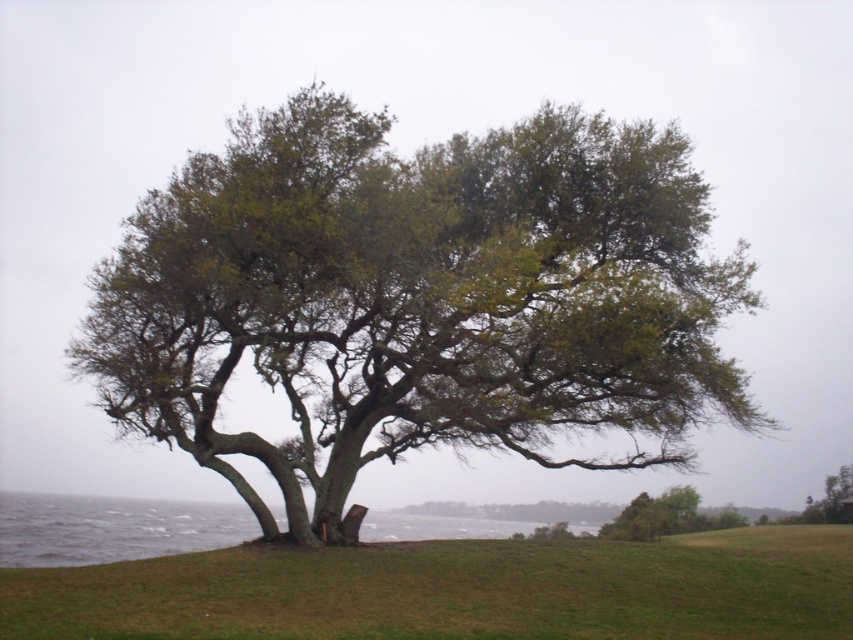
You are a photographer planning to capture the green leafy tree at center and the green grassy at lower center in a single frame. Based on their widths, which object should you position closer to the center of your camera viewfinder to ensure both fit without cropping?

Result: The green leafy tree at center is thinner than the green grassy at lower center. To fit both without cropping, position the wider green grassy at lower center closer to the center of the camera viewfinder so it occupies more space, while the thinner tree can be placed slightly off to one side.

You are standing at the point marked as point (456, 589) in the image. What is the terrain like at that location?

The terrain at point (456, 589) is green grassy at lower center.